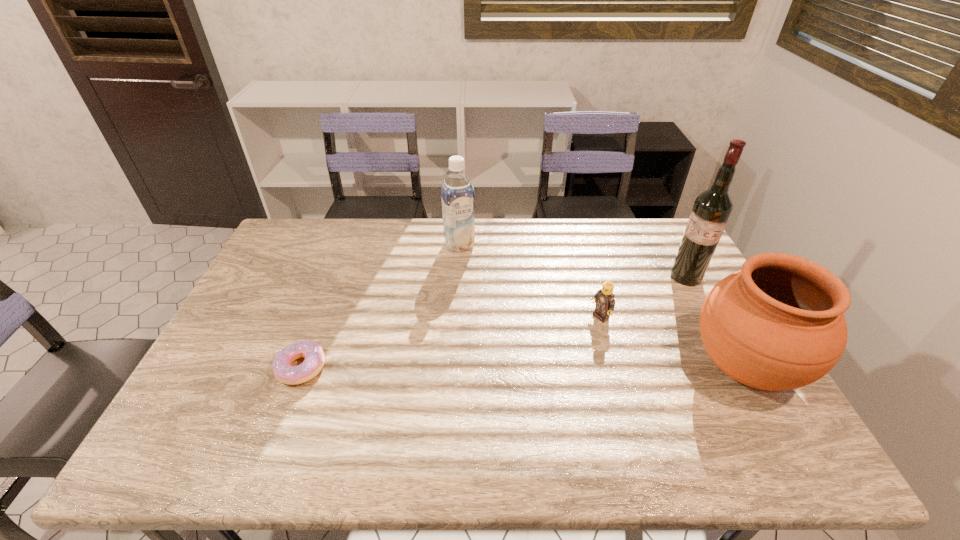
Find the location of a particular element. free space located 0.190m on the left of the pottery is located at coordinates (614, 367).

This screenshot has width=960, height=540. Find the location of `free space located on the label of the farthest object`. free space located on the label of the farthest object is located at coordinates (490, 303).

This screenshot has height=540, width=960. What are the coordinates of `vacant space located on the label of the farthest object` in the screenshot? It's located at click(486, 295).

At what (x,y) coordinates should I click in order to perform the action: click on vacant area situated 0.390m on the label of the farthest object. Please return your answer as a coordinate pair (x, y). Image resolution: width=960 pixels, height=540 pixels. Looking at the image, I should click on (506, 334).

Where is `free location located in front of the second shortest object`? free location located in front of the second shortest object is located at coordinates (513, 372).

The height and width of the screenshot is (540, 960). I want to click on vacant space situated 0.280m in front of the second shortest object, so click(518, 368).

The height and width of the screenshot is (540, 960). I want to click on vacant point located in front of the second shortest object, so click(x=492, y=385).

Find the location of `free space located on the front and back of the tallest object`. free space located on the front and back of the tallest object is located at coordinates (624, 319).

Locate an element on the screen. The image size is (960, 540). free space located on the front and back of the tallest object is located at coordinates (667, 289).

This screenshot has height=540, width=960. What are the coordinates of `vacant space located 0.180m on the front and back of the tallest object` in the screenshot? It's located at (641, 307).